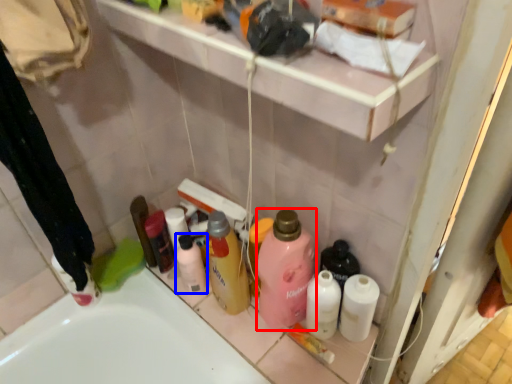
Question: Among these objects, which one is farthest to the camera, cleaning product (highlighted by a red box) or toiletry (highlighted by a blue box)?

Choices:
 (A) cleaning product
 (B) toiletry

Answer: (B)